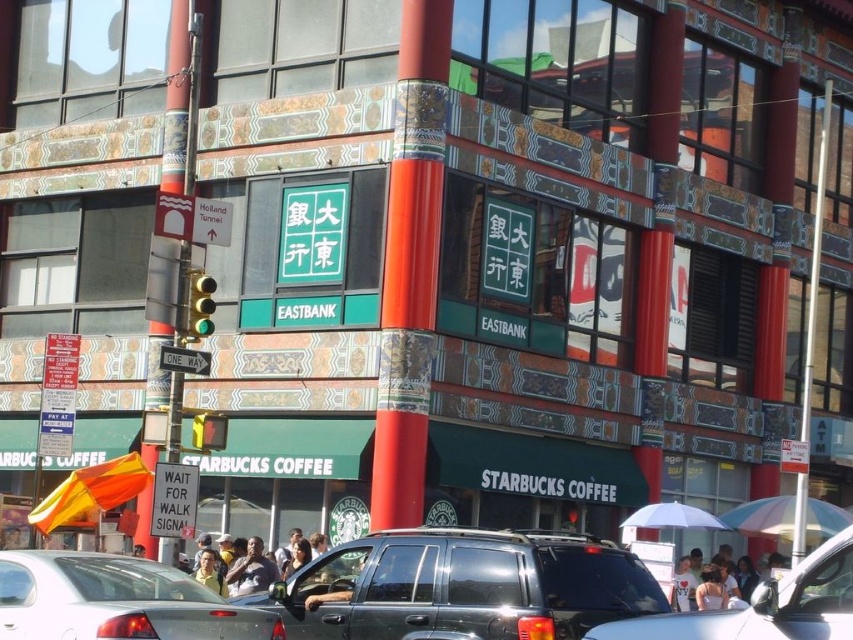
Which is more to the right, metallic pole at left or green glass traffic light at left?

Positioned to the right is green glass traffic light at left.

Does metallic pole at left have a greater height compared to green glass traffic light at left?

Indeed, metallic pole at left has a greater height compared to green glass traffic light at left.

Who is more distant from viewer, (175, 192) or (213, 280)?

Point (175, 192)

The height and width of the screenshot is (640, 853). In order to click on metallic pole at left in this screenshot , I will do `click(177, 99)`.

Can you confirm if matte gray shirt at center is shorter than green glass traffic light at left?

Correct, matte gray shirt at center is not as tall as green glass traffic light at left.

Is matte gray shirt at center to the left of green glass traffic light at left from the viewer's perspective?

In fact, matte gray shirt at center is to the right of green glass traffic light at left.

At what (x,y) coordinates should I click in order to perform the action: click on matte gray shirt at center. Please return your answer as a coordinate pair (x, y). The width and height of the screenshot is (853, 640). Looking at the image, I should click on (247, 572).

The height and width of the screenshot is (640, 853). I want to click on matte gray shirt at center, so [247, 572].

Image resolution: width=853 pixels, height=640 pixels. What do you see at coordinates (410, 264) in the screenshot?
I see `smooth red pillar at center` at bounding box center [410, 264].

Is point (444, 20) less distant than point (248, 516)?

Yes, it is.

Locate an element on the screen. This screenshot has width=853, height=640. smooth red pillar at center is located at coordinates (410, 264).